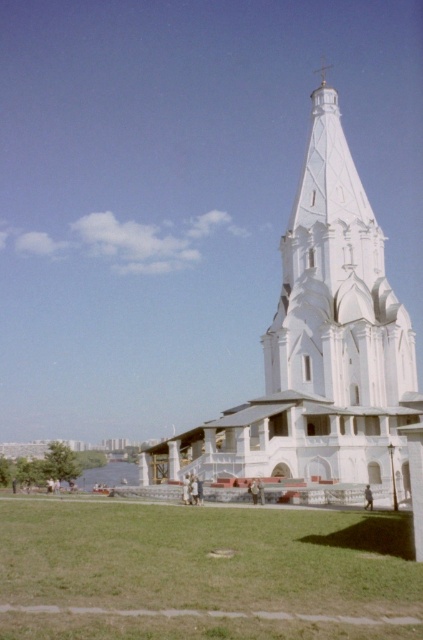
Who is more forward, (10, 589) or (335, 253)?

Point (10, 589) is in front.

Is point (140, 540) in front of point (356, 412)?

Yes, it is.

Between point (219, 577) and point (331, 140), which one is positioned behind?

The point (331, 140) is behind.

The width and height of the screenshot is (423, 640). I want to click on green grass at lower center, so click(203, 572).